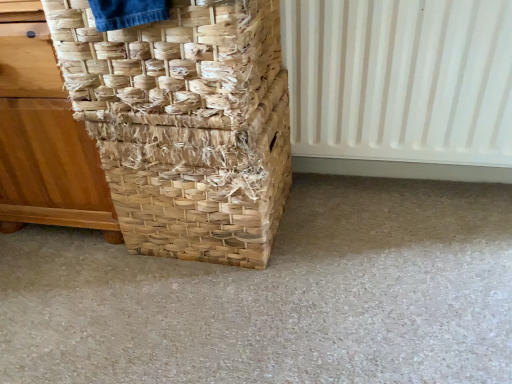
Question: In terms of width, does natural woven basket at left, the 2th basket when ordered from bottom to top, look wider or thinner when compared to white plastic radiator at right?

Choices:
 (A) wide
 (B) thin

Answer: (A)

Question: From the image's perspective, is natural woven basket at left, the 2th basket when ordered from bottom to top, positioned above or below white plastic radiator at right?

Choices:
 (A) below
 (B) above

Answer: (B)

Question: Based on their relative distances, which object is nearer to the natural woven basket at left, the 2th basket when ordered from bottom to top?

Choices:
 (A) natural woven basket at left
 (B) white plastic radiator at right
 (C) natural woven basket at center, the first basket ordered from the bottom

Answer: (C)

Question: Which object is the closest to the natural woven basket at left, the 2th basket when ordered from bottom to top?

Choices:
 (A) natural woven basket at center, the first basket ordered from the bottom
 (B) white plastic radiator at right
 (C) natural woven basket at left

Answer: (A)